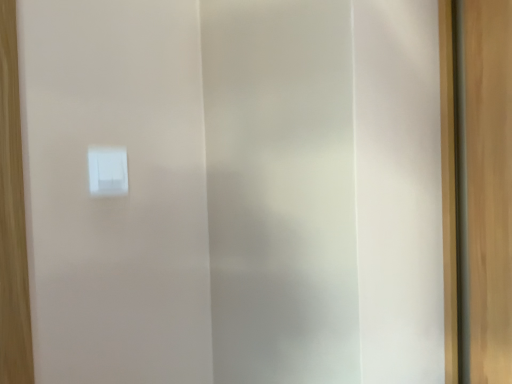
Describe the element at coordinates (106, 171) in the screenshot. This screenshot has height=384, width=512. I see `white plastic light switch at upper left` at that location.

Locate an element on the screen. The image size is (512, 384). white plastic light switch at upper left is located at coordinates (106, 171).

The image size is (512, 384). Find the location of `white plastic light switch at upper left`. white plastic light switch at upper left is located at coordinates (106, 171).